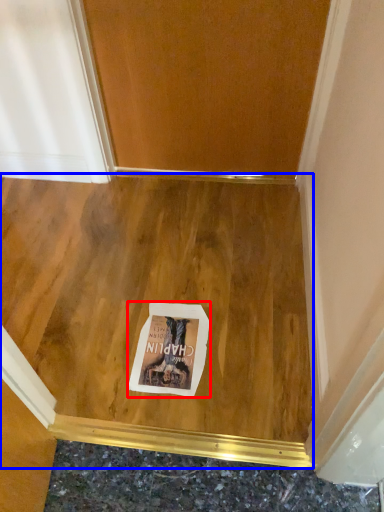
Question: Which object is further to the camera taking this photo, postcard (highlighted by a red box) or plywood (highlighted by a blue box)?

Choices:
 (A) postcard
 (B) plywood

Answer: (A)